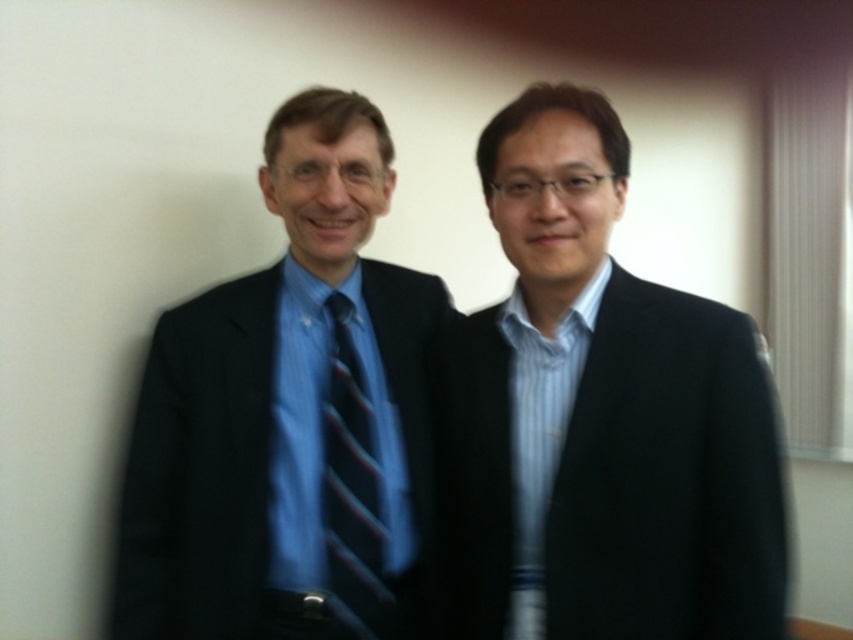
You are an event planner arranging seating for a formal dinner. You need to seat two guests wearing matte black suit at right and matte black suit at left. The table has limited space between chairs. Which guest should you seat closer to the center of the table to ensure their suits don not touch?

The matte black suit at right has a lesser width compared to the matte black suit at left. Therefore, the guest wearing the matte black suit at right should be seated closer to the center to minimize the chance of their suits touching, as their suit is narrower and requires less space.

You are organizing a formal event and need to ensure that the matte black suit at left and the blue striped tie at center are displayed properly. Given their sizes, which one would require a larger display space?

The matte black suit at left requires a larger display space because it has a larger size compared to the blue striped tie at center.